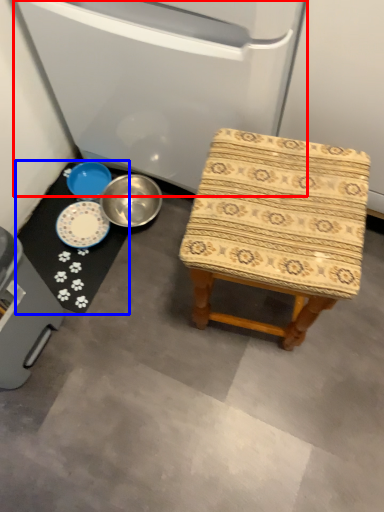
Question: Which point is closer to the camera, appliance (highlighted by a red box) or mat (highlighted by a blue box)?

Choices:
 (A) appliance
 (B) mat

Answer: (A)